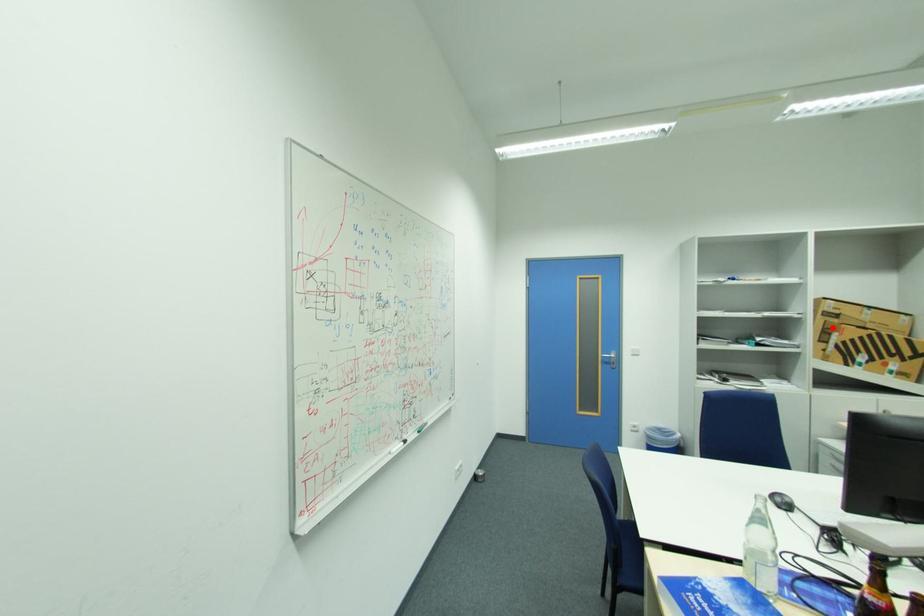
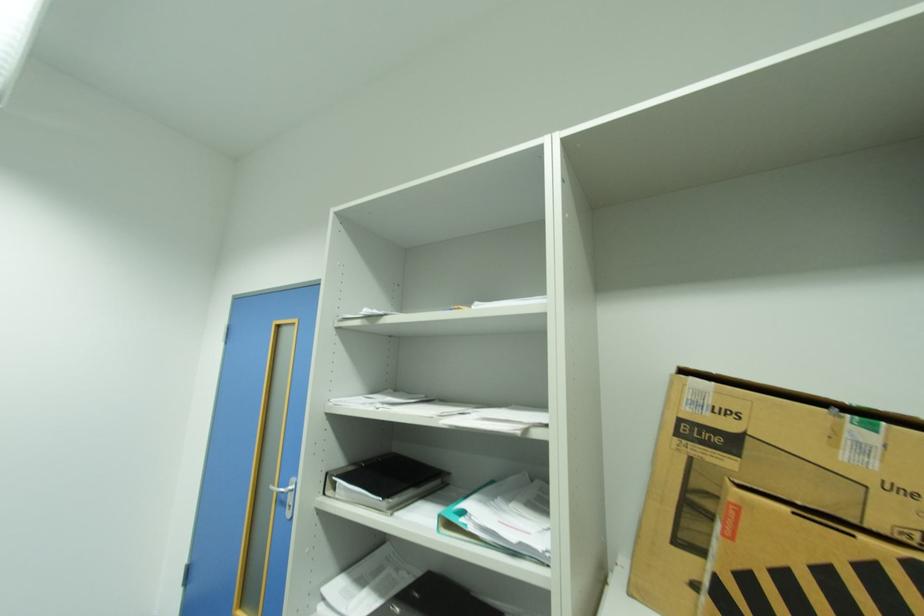
Where in the second image is the point corresponding to the highlighted location from the first image?

(700, 487)